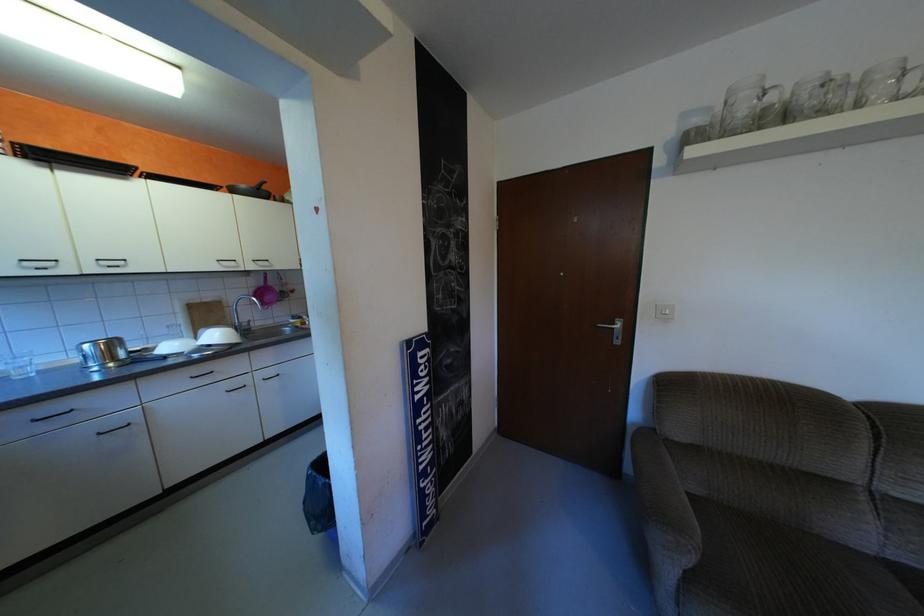
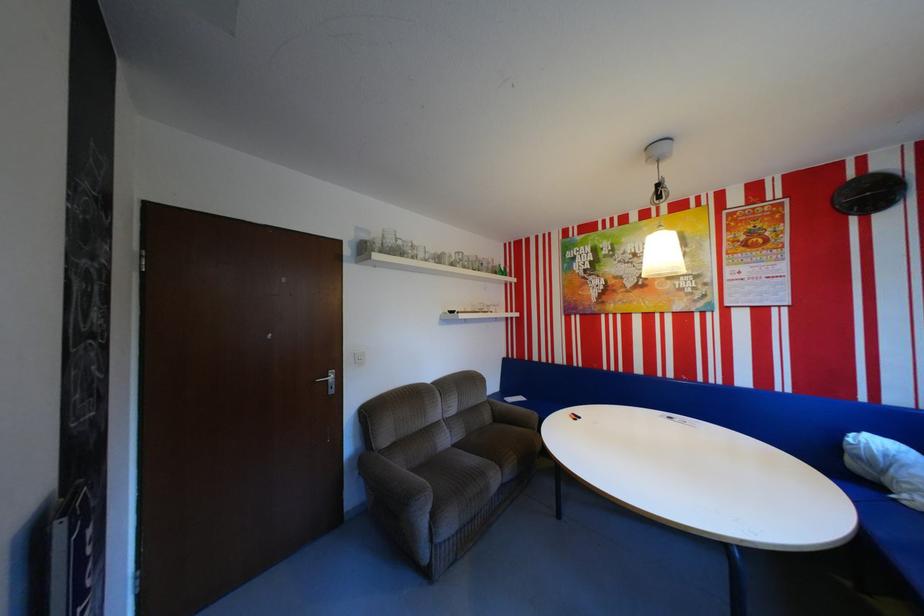
Question: How did the camera likely rotate?

Choices:
 (A) Left
 (B) Right
 (C) Up
 (D) Down

Answer: (B)